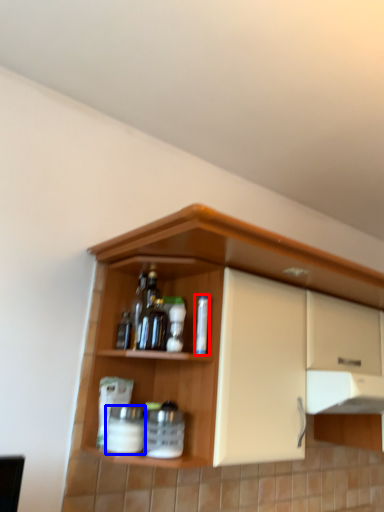
Question: Which point is further to the camera, bottle (highlighted by a red box) or beverage (highlighted by a blue box)?

Choices:
 (A) bottle
 (B) beverage

Answer: (A)